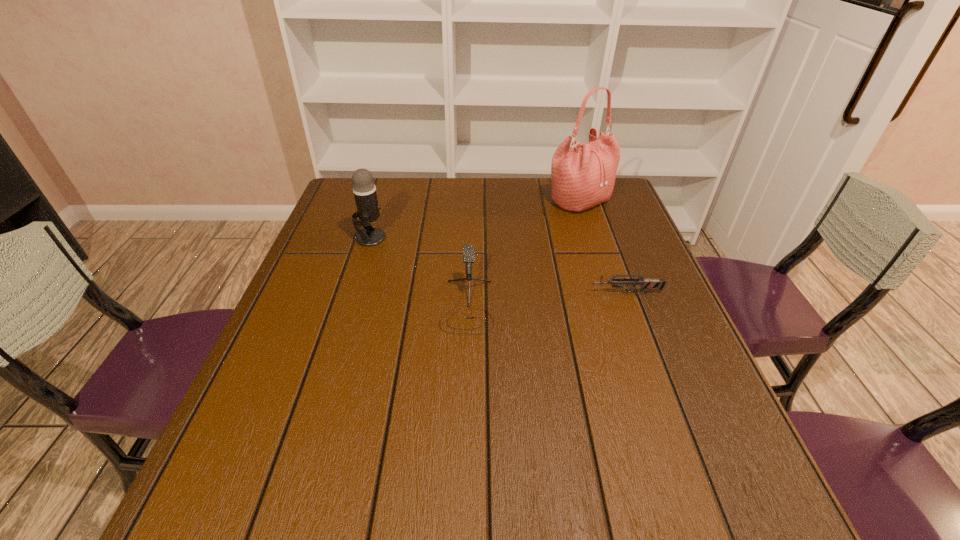
Find the location of a particular element. This screenshot has width=960, height=540. empty space between the second shortest object and the taller microphone is located at coordinates (419, 271).

The width and height of the screenshot is (960, 540). In order to click on free space between the nearer microphone and the gun in this screenshot , I will do `click(546, 299)`.

Where is `free point between the handbag and the gun`? This screenshot has width=960, height=540. free point between the handbag and the gun is located at coordinates (602, 246).

You are a GUI agent. You are given a task and a screenshot of the screen. Output one action in this format:
    pyautogui.click(x=<x>, y=<y>)
    Task: Click on the vacant point located between the handbag and the gun
    Image resolution: width=960 pixels, height=540 pixels.
    Given the screenshot: What is the action you would take?
    pyautogui.click(x=602, y=246)

Locate which object ranks second in proximity to the farthest object. Please provide its 2D coordinates. Your answer should be formatted as a tuple, i.e. [(x, y)], where the tuple contains the x and y coordinates of a point satisfying the conditions above.

[(468, 252)]

This screenshot has width=960, height=540. Find the location of `the closest object relative to the tallest object`. the closest object relative to the tallest object is located at coordinates (645, 284).

Locate an element on the screen. The height and width of the screenshot is (540, 960). vacant point that satisfies the following two spatial constraints: 1. on the back side of the taller microphone; 2. on the right side of the handbag is located at coordinates (382, 200).